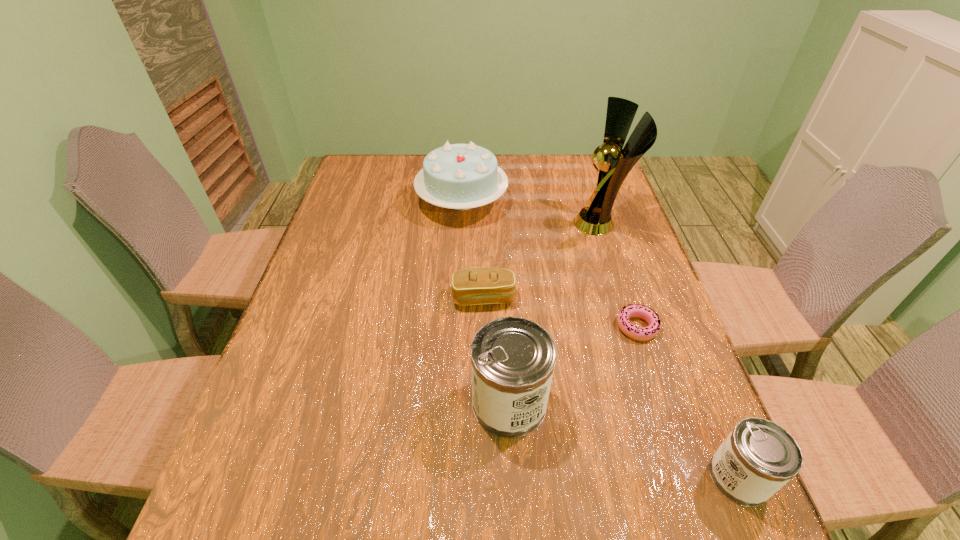
You are a GUI agent. You are given a task and a screenshot of the screen. Output one action in this format:
    pyautogui.click(x=<x>, y=<y>)
    Task: Click on the vacant space that's between the right can and the farther can
    The width and height of the screenshot is (960, 540).
    Given the screenshot: What is the action you would take?
    pyautogui.click(x=624, y=440)

Image resolution: width=960 pixels, height=540 pixels. I want to click on free space between the award and the birthday cake, so click(x=532, y=212).

At what (x,y) coordinates should I click in order to perform the action: click on vacant point located between the tallest object and the farther can. Please return your answer as a coordinate pair (x, y). This screenshot has width=960, height=540. Looking at the image, I should click on (555, 313).

In order to click on vacant area between the nearest object and the fifth farthest object in this screenshot , I will do `click(624, 440)`.

Locate an element on the screen. This screenshot has height=540, width=960. vacant area that lies between the doughnut and the birthday cake is located at coordinates (549, 264).

Locate an element on the screen. vacant space that is in between the fourth nearest object and the award is located at coordinates (542, 260).

This screenshot has height=540, width=960. What are the coordinates of `vacant space that's between the shorter can and the farther can` in the screenshot? It's located at (624, 440).

Locate an element on the screen. The height and width of the screenshot is (540, 960). vacant space that's between the third nearest object and the second shortest object is located at coordinates (561, 312).

Identify which object is the fourth nearest to the farther can. Please provide its 2D coordinates. Your answer should be formatted as a tuple, i.e. [(x, y)], where the tuple contains the x and y coordinates of a point satisfying the conditions above.

[(615, 162)]

Where is `the fifth closest object to the second shortest object`? the fifth closest object to the second shortest object is located at coordinates (758, 457).